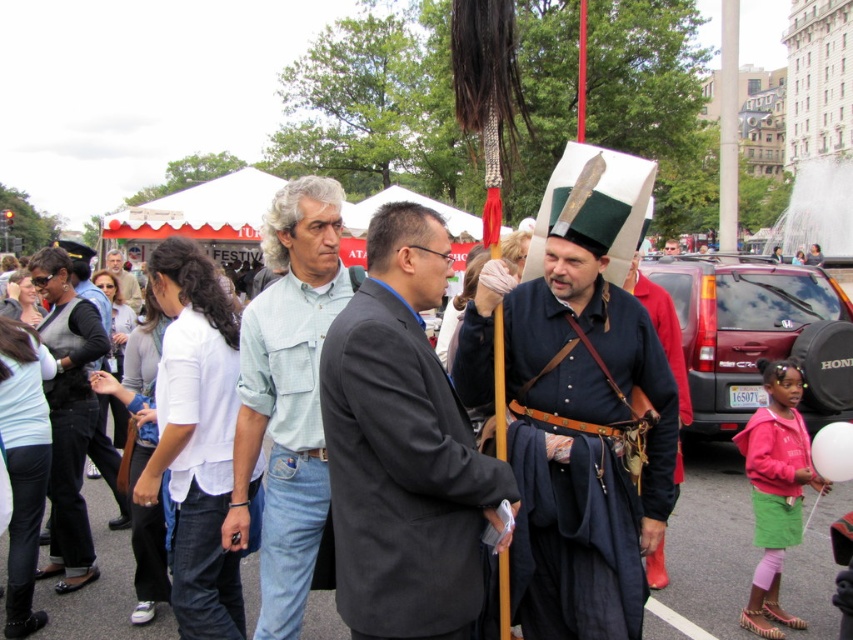
Based on the photo, who is more forward, (119, 273) or (664, 252)?

Point (119, 273)

Find the location of `light blue denim shirt at center`. light blue denim shirt at center is located at coordinates (123, 278).

Does green checkered shirt at center have a lesser height compared to matte black hat at center?

No, green checkered shirt at center is not shorter than matte black hat at center.

Which is below, green checkered shirt at center or matte black hat at center?

Positioned lower is green checkered shirt at center.

You are a GUI agent. You are given a task and a screenshot of the screen. Output one action in this format:
    pyautogui.click(x=<x>, y=<y>)
    Task: Click on the green checkered shirt at center
    This screenshot has height=640, width=853.
    Given the screenshot: What is the action you would take?
    pyautogui.click(x=287, y=397)

Is green checkered shirt at center thinner than black leather jacket at center?

Correct, green checkered shirt at center's width is less than black leather jacket at center's.

Is green checkered shirt at center to the right of black leather jacket at center from the viewer's perspective?

Yes, green checkered shirt at center is to the right of black leather jacket at center.

Where is `green checkered shirt at center`? green checkered shirt at center is located at coordinates (287, 397).

This screenshot has height=640, width=853. I want to click on green checkered shirt at center, so click(x=287, y=397).